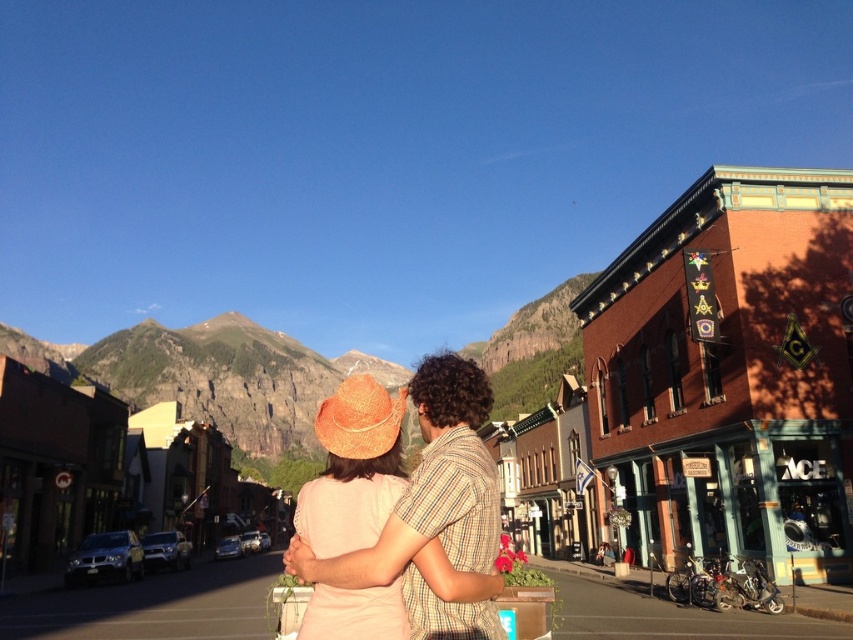
Between straw hat at center and brown straw hat at center, which one is positioned higher?

straw hat at center is above.

Between straw hat at center and brown straw hat at center, which one has more height?

With more height is straw hat at center.

You are a GUI agent. You are given a task and a screenshot of the screen. Output one action in this format:
    pyautogui.click(x=<x>, y=<y>)
    Task: Click on the straw hat at center
    The height and width of the screenshot is (640, 853).
    Given the screenshot: What is the action you would take?
    pyautogui.click(x=399, y=513)